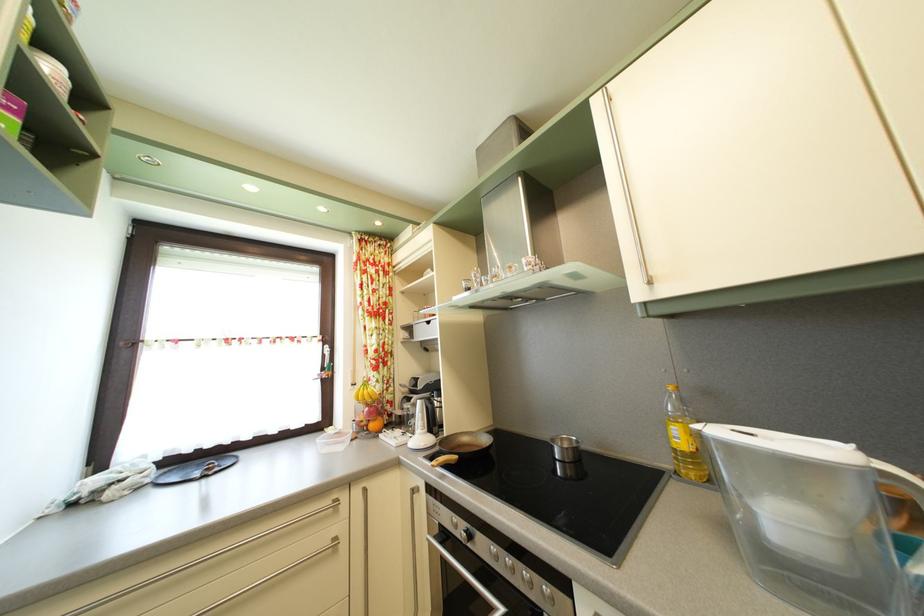
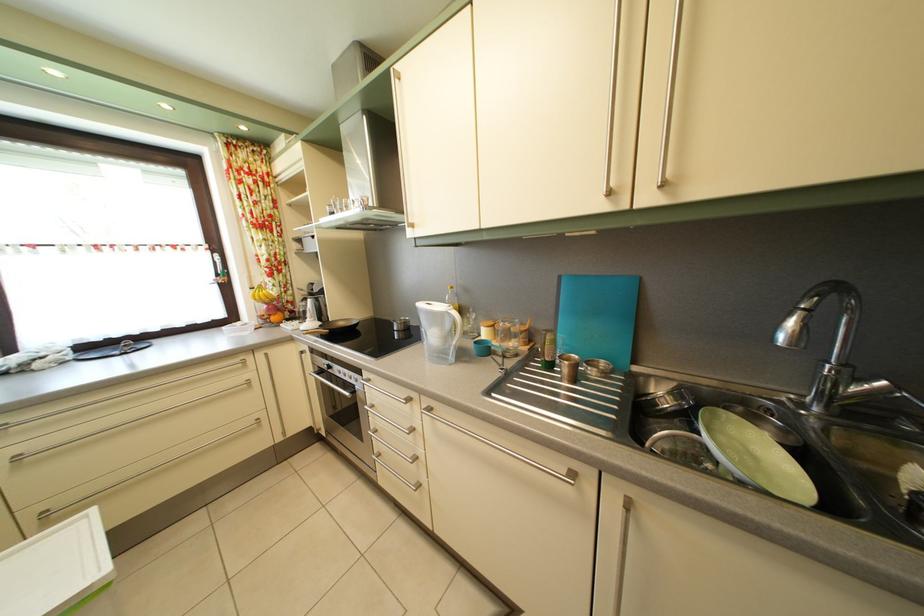
Locate, in the second image, the point that corresponds to (478,545) in the first image.

(337, 374)